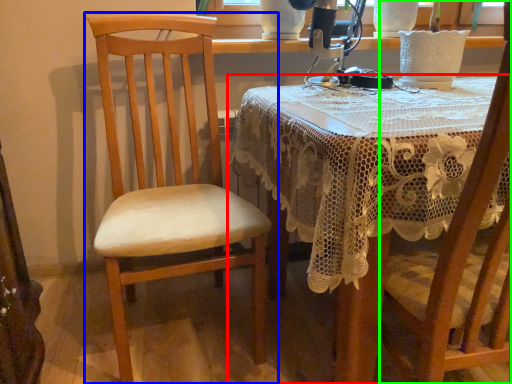
Question: Based on their relative distances, which object is farther from table (highlighted by a red box)? Choose from chair (highlighted by a blue box) and chair (highlighted by a green box).

Choices:
 (A) chair
 (B) chair

Answer: (A)